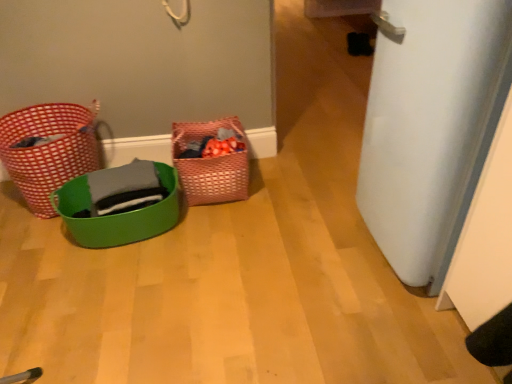
Where is `vacant area located to the right-hand side of woven pink basket at center, arranged as the 1th basket when viewed from the right`? Image resolution: width=512 pixels, height=384 pixels. vacant area located to the right-hand side of woven pink basket at center, arranged as the 1th basket when viewed from the right is located at coordinates (272, 192).